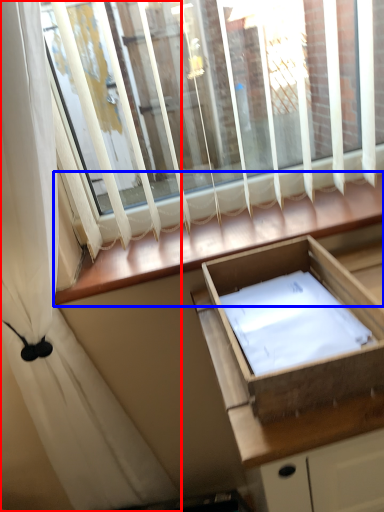
Question: Which of the following is the closest to the observer, curtain (highlighted by a red box) or window sill (highlighted by a blue box)?

Choices:
 (A) curtain
 (B) window sill

Answer: (A)